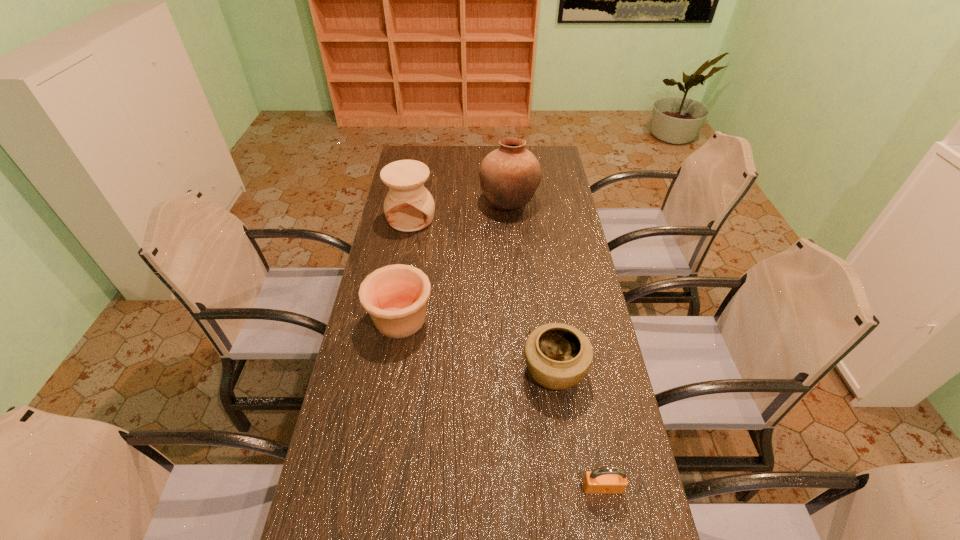
In the image, there is a desktop. Where is `blank space at the right edge`? The image size is (960, 540). blank space at the right edge is located at coordinates (539, 191).

Image resolution: width=960 pixels, height=540 pixels. In order to click on free space at the far right corner of the desktop in this screenshot , I will do `click(547, 152)`.

I want to click on unoccupied position between the second tallest object and the tallest pottery, so click(x=460, y=210).

Where is `free area in between the second tallest object and the tallest pottery`? The height and width of the screenshot is (540, 960). free area in between the second tallest object and the tallest pottery is located at coordinates (460, 210).

Find the location of a particular element. The width and height of the screenshot is (960, 540). the second closest object to the nearest object is located at coordinates (395, 296).

Find the location of a particular element. This screenshot has height=540, width=960. object that can be found as the third closest to the tallest object is located at coordinates (558, 356).

Locate an element on the screen. This screenshot has height=540, width=960. the second closest pottery to the third shortest pottery is located at coordinates (395, 296).

Image resolution: width=960 pixels, height=540 pixels. I want to click on pottery object that ranks as the third closest to the second tallest pottery, so click(558, 356).